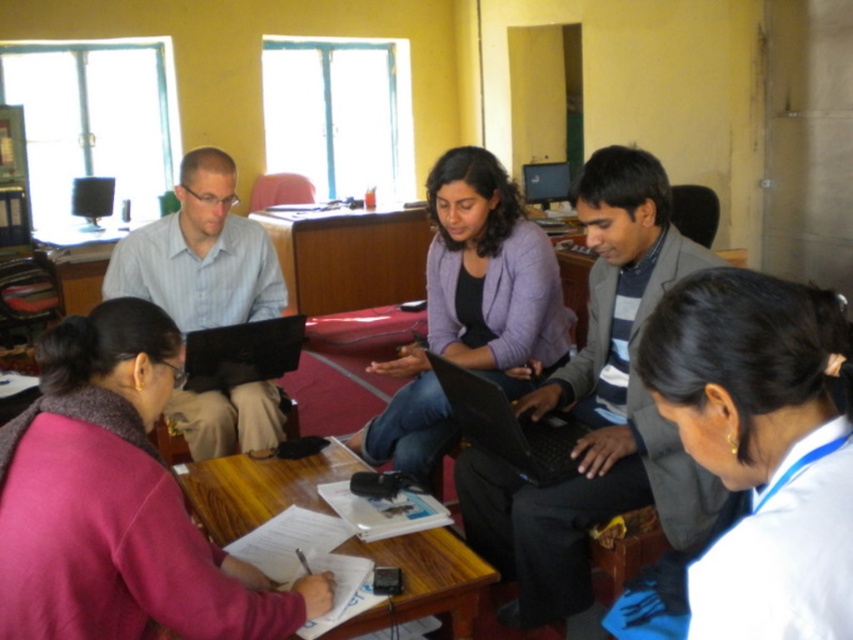
You are standing at the entrance of the room and want to locate the matte light blue shirt at upper left and the black glossy laptop at center. Based on their positions, which object is closer to the ceiling?

The matte light blue shirt at upper left is above the black glossy laptop at center, so the matte light blue shirt at upper left is closer to the ceiling.

You are a new participant entering the room and want to sit next to the person wearing the matte light blue shirt at upper left. Which side of the black glossy laptop at center should you sit on to be closest to that person?

The matte light blue shirt at upper left is to the left of the black glossy laptop at center, so you should sit to the left side of the black glossy laptop at center to be closest to the person wearing the matte light blue shirt at upper left.